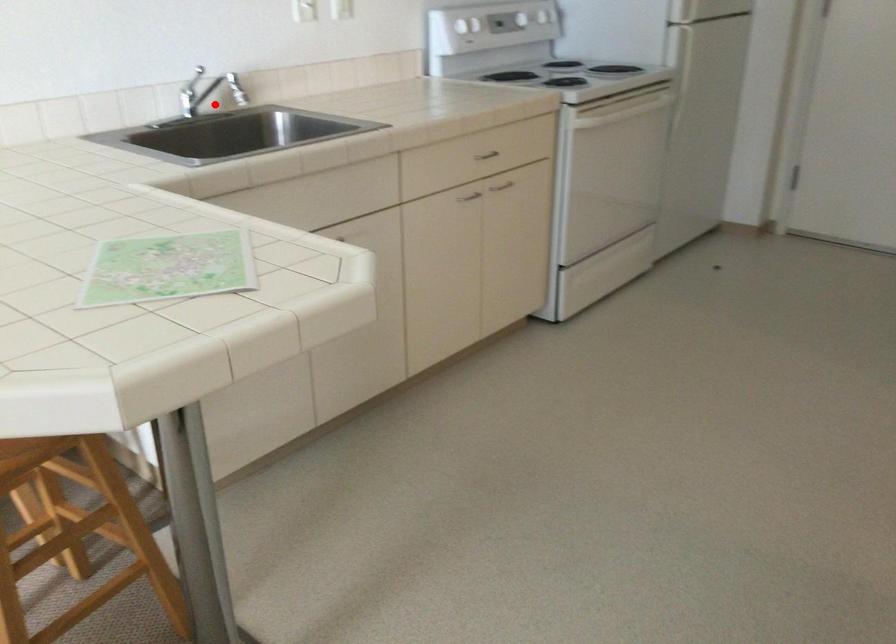
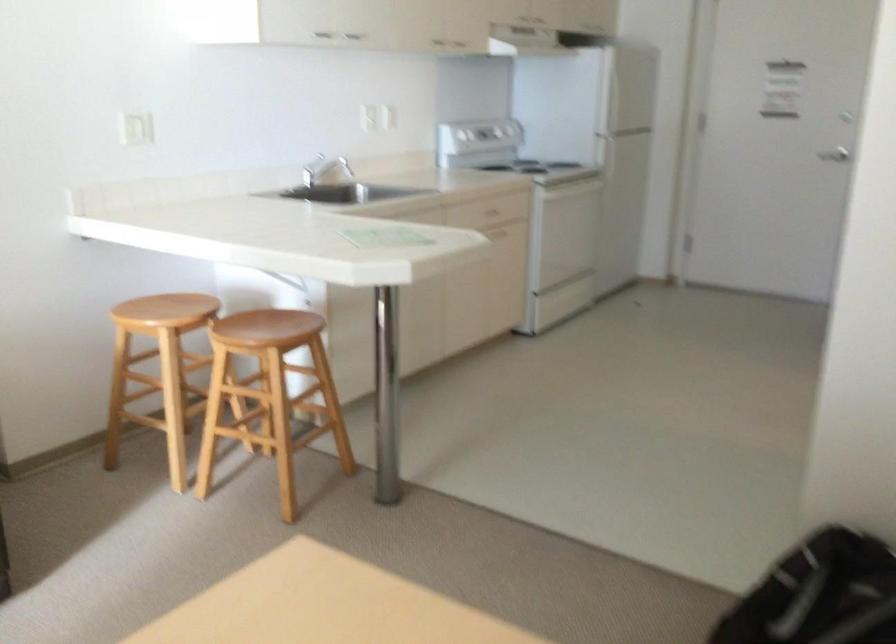
Question: I am providing you with two images of the same scene from different viewpoints. Image1 has a red point marked. In image2, the corresponding 3D location appears at what relative position? Reply with the corresponding letter.

Choices:
 (A) Closer
 (B) Farther

Answer: (B)